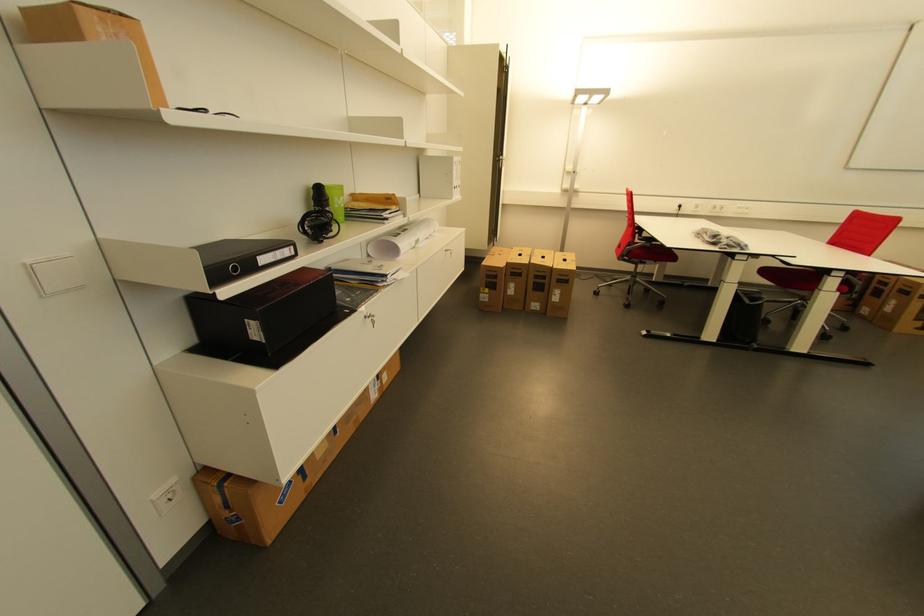
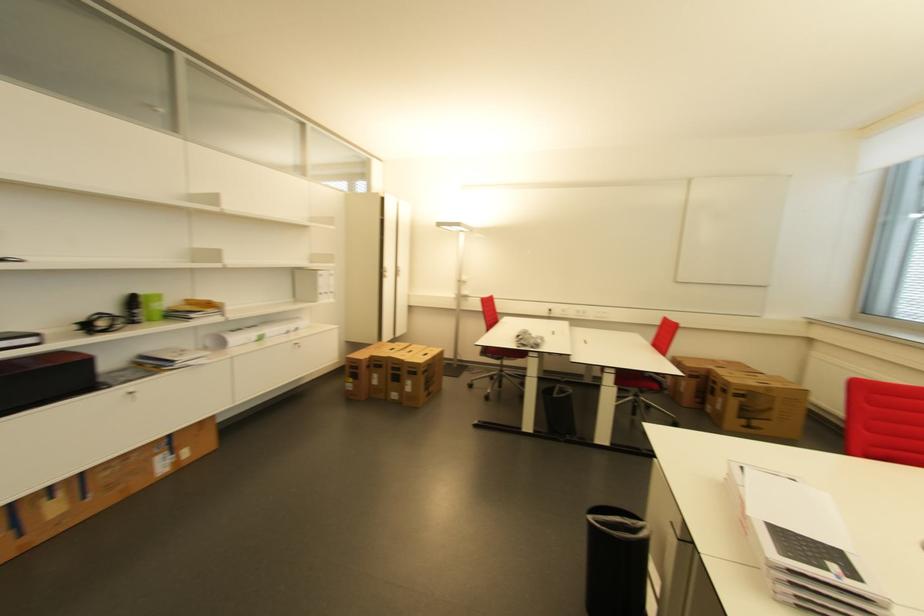
Where in the second image is the point corresponding to the point at 452,252 from the first image?

(300, 345)